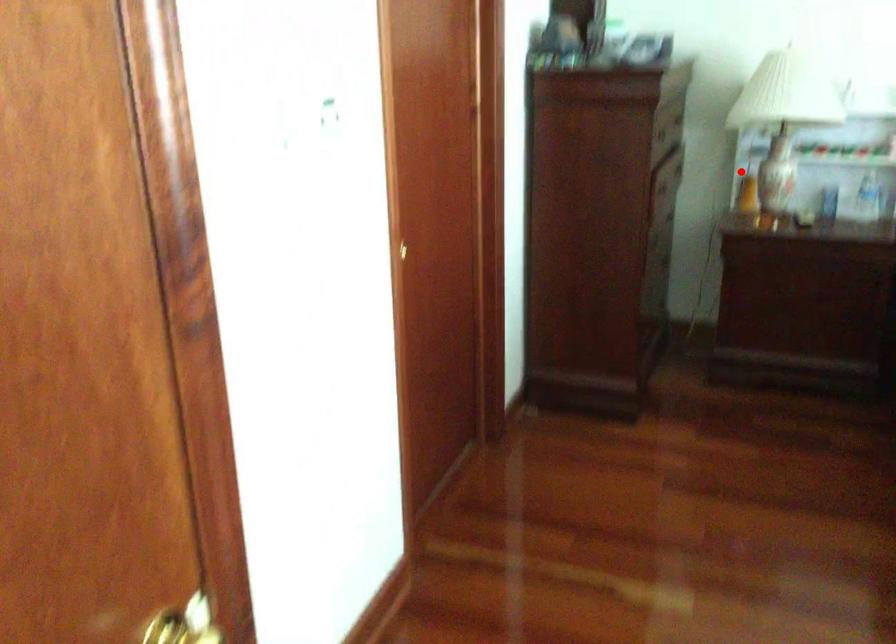
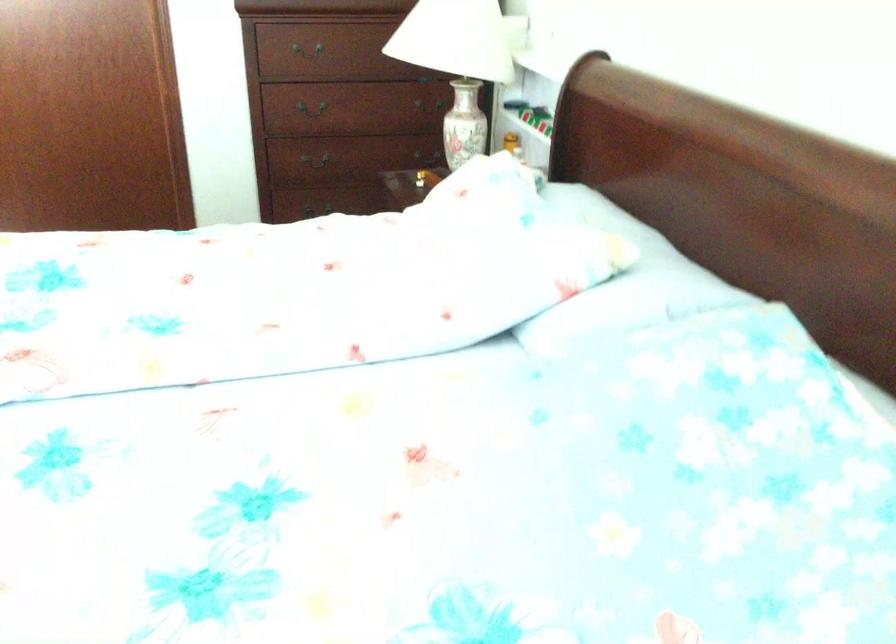
Question: I am providing you with two images of the same scene from different viewpoints. Given a red point in image1, look at the same physical point in image2. Is it:

Choices:
 (A) Closer to the viewpoint
 (B) Farther from the viewpoint

Answer: (A)